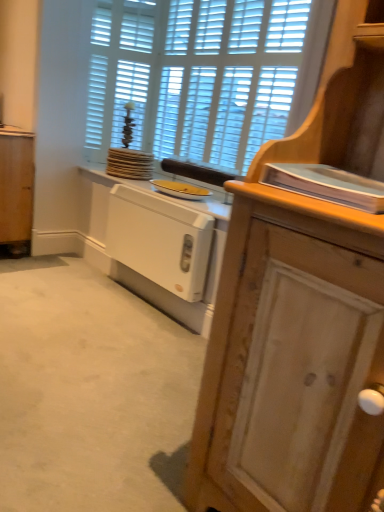
Question: Is wooden cabinet at right smaller than white wooden shutters at upper center?

Choices:
 (A) yes
 (B) no

Answer: (B)

Question: Is wooden cabinet at right at the right side of white wooden shutters at upper center?

Choices:
 (A) yes
 (B) no

Answer: (B)

Question: From the image's perspective, would you say wooden cabinet at right is shown under white wooden shutters at upper center?

Choices:
 (A) yes
 (B) no

Answer: (A)

Question: Considering the relative sizes of wooden cabinet at right and white wooden shutters at upper center in the image provided, is wooden cabinet at right taller than white wooden shutters at upper center?

Choices:
 (A) no
 (B) yes

Answer: (A)

Question: Does wooden cabinet at right have a greater width compared to white wooden shutters at upper center?

Choices:
 (A) yes
 (B) no

Answer: (A)

Question: Is yellow matte plate at center wider or thinner than white painted wood radiator at lower center, which appears as the second cabinetry when viewed from the left?

Choices:
 (A) wide
 (B) thin

Answer: (A)

Question: Is yellow matte plate at center bigger or smaller than white painted wood radiator at lower center, the 2th cabinetry viewed from the right?

Choices:
 (A) small
 (B) big

Answer: (A)

Question: Is point (177, 189) closer or farther from the camera than point (150, 265)?

Choices:
 (A) farther
 (B) closer

Answer: (A)

Question: From the image's perspective, relative to white painted wood radiator at lower center, which appears as the second cabinetry when viewed from the left, is yellow matte plate at center above or below?

Choices:
 (A) above
 (B) below

Answer: (A)

Question: Is white painted wood radiator at lower center, placed as the second cabinetry when sorted from back to front, in front of or behind yellow matte plate at center in the image?

Choices:
 (A) behind
 (B) front

Answer: (B)

Question: From the image's perspective, is white painted wood radiator at lower center, placed as the second cabinetry when sorted from back to front, above or below yellow matte plate at center?

Choices:
 (A) above
 (B) below

Answer: (B)

Question: In terms of width, does white painted wood radiator at lower center, the 2th cabinetry viewed from the right, look wider or thinner when compared to yellow matte plate at center?

Choices:
 (A) wide
 (B) thin

Answer: (B)

Question: Is point (137, 266) closer or farther from the camera than point (158, 181)?

Choices:
 (A) farther
 (B) closer

Answer: (B)

Question: Is point (155, 244) positioned closer to the camera than point (334, 227)?

Choices:
 (A) farther
 (B) closer

Answer: (A)

Question: From a real-world perspective, relative to wooden cabinet at right, the third cabinetry when ordered from back to front, is white painted wood radiator at lower center, the 2th cabinetry viewed from the right, vertically above or below?

Choices:
 (A) below
 (B) above

Answer: (A)